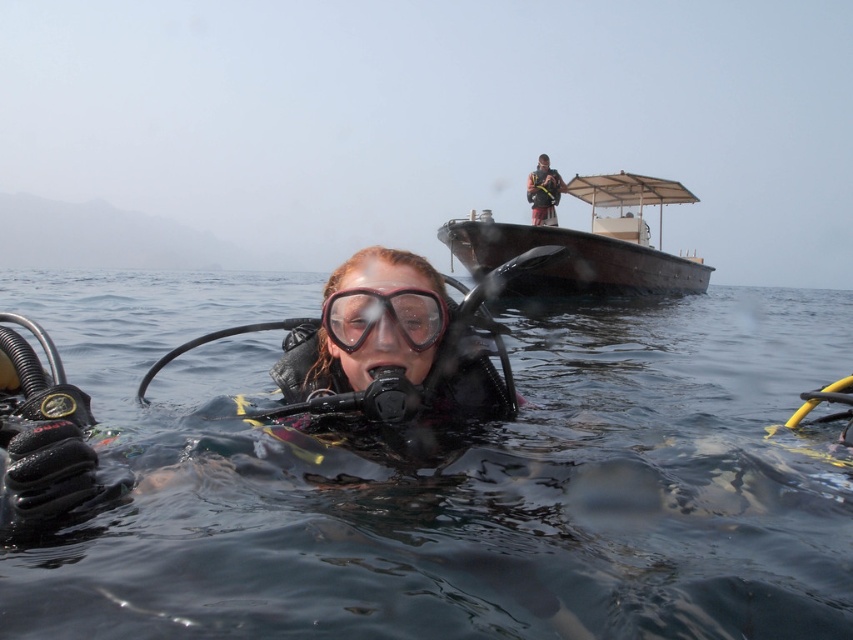
You are a diver in the water and you see a point marked at coordinates point (585,243). What is the location of this point relative to the wooden boat at upper center?

The point (585,243) is located on the wooden boat at upper center.

You are a diver planning to swim from your current position to the boat. There is a point marked at coordinates (451, 480) where transparent water at center is located. Will you pass through the transparent water at center before reaching the boat?

Yes, since the transparent water at center is located at point (451, 480), which is along the path towards the boat, you will pass through it before reaching the boat.

You are the diver in the underwater scene. You notice two points marked in the water. The first point is at coordinates point (712, 500) and the second is at point (399, 332). From your current position, which point is farther away from you?

Point (712, 500) is behind point (399, 332), so the farther point from you is point (712, 500).